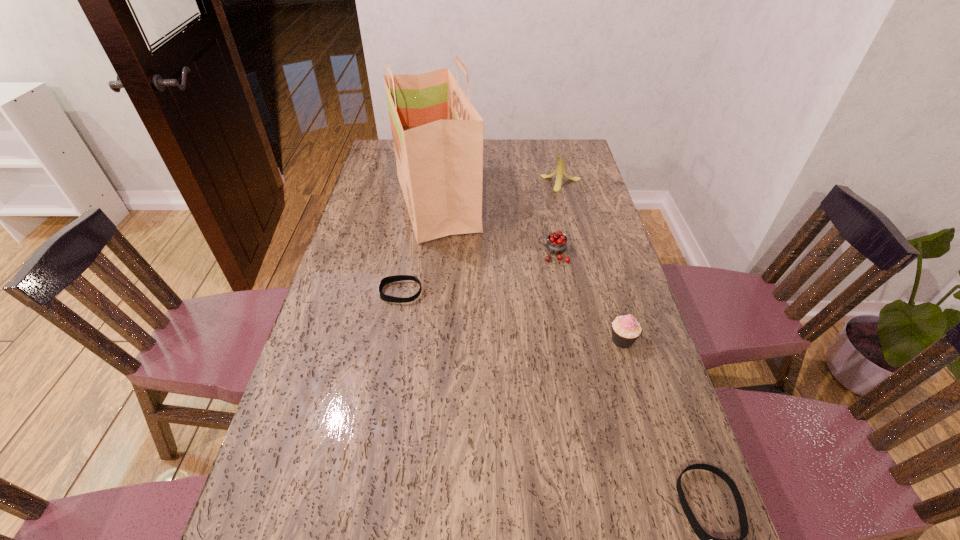
Where is `the shorter wristband`? This screenshot has height=540, width=960. the shorter wristband is located at coordinates (390, 279).

This screenshot has width=960, height=540. In order to click on the left wristband in this screenshot , I will do `click(390, 279)`.

Where is `cherry`? cherry is located at coordinates (556, 244).

The height and width of the screenshot is (540, 960). Find the location of `the tallest object`. the tallest object is located at coordinates (437, 134).

Identify the location of the second tallest object. The width and height of the screenshot is (960, 540). (560, 170).

Image resolution: width=960 pixels, height=540 pixels. What are the coordinates of `the second nearest object` in the screenshot? It's located at (626, 330).

Locate an element on the screen. Image resolution: width=960 pixels, height=540 pixels. vacant space located 0.090m on the display of the farther wristband is located at coordinates (348, 292).

Where is `blank area located 0.130m on the display of the farther wristband`? Image resolution: width=960 pixels, height=540 pixels. blank area located 0.130m on the display of the farther wristband is located at coordinates pyautogui.click(x=335, y=292).

What are the coordinates of `vacant space located 0.080m on the display of the farther wristband` in the screenshot? It's located at (351, 292).

Where is `free space located 0.360m on the handle side of the cherry`? free space located 0.360m on the handle side of the cherry is located at coordinates (426, 253).